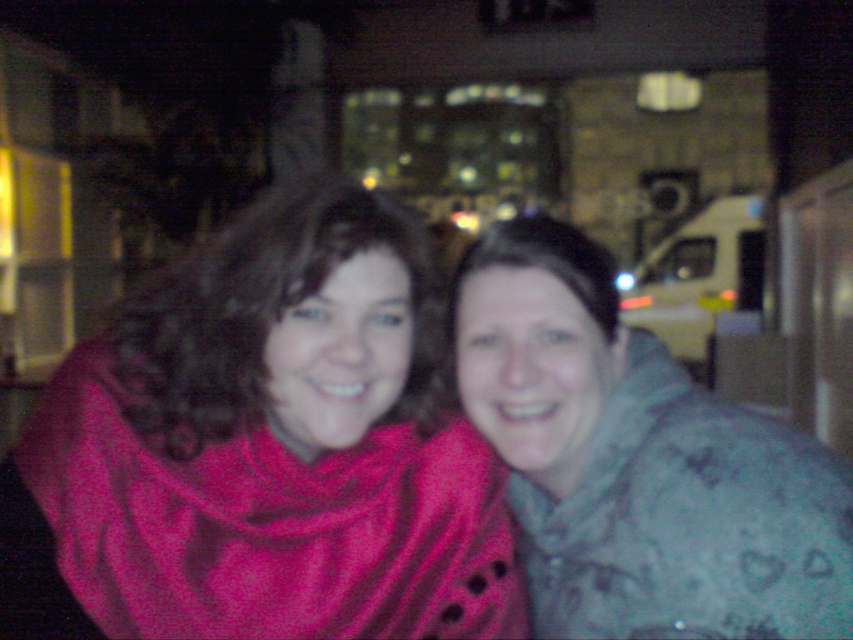
Is point (308, 488) in front of point (846, 532)?

No, it is behind (846, 532).

Measure the distance between matte red scarf at left and gray fuzzy jacket at center.

The distance of matte red scarf at left from gray fuzzy jacket at center is 8.01 inches.

Locate an element on the screen. This screenshot has width=853, height=640. matte red scarf at left is located at coordinates (276, 442).

Image resolution: width=853 pixels, height=640 pixels. I want to click on matte red scarf at left, so click(276, 442).